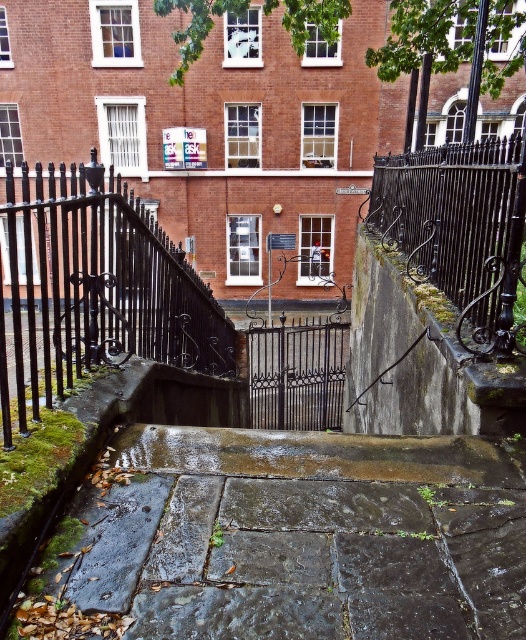
Question: Which of the following is the closest to the observer?

Choices:
 (A) (174, 317)
 (B) (494, 330)

Answer: (B)

Question: Is black wrought iron fence at center in front of black wrought iron fence at right?

Choices:
 (A) no
 (B) yes

Answer: (B)

Question: Where is wet stone pavement at center located in relation to black wrought iron fence at right in the image?

Choices:
 (A) right
 (B) left

Answer: (B)

Question: Which point is farther from the camera taking this photo?

Choices:
 (A) (15, 355)
 (B) (109, 540)

Answer: (A)

Question: Which of the following is the farthest from the observer?

Choices:
 (A) (524, 220)
 (B) (479, 442)
 (C) (53, 337)

Answer: (C)

Question: Does black wrought iron fence at center have a larger size compared to black wrought iron fence at right?

Choices:
 (A) yes
 (B) no

Answer: (A)